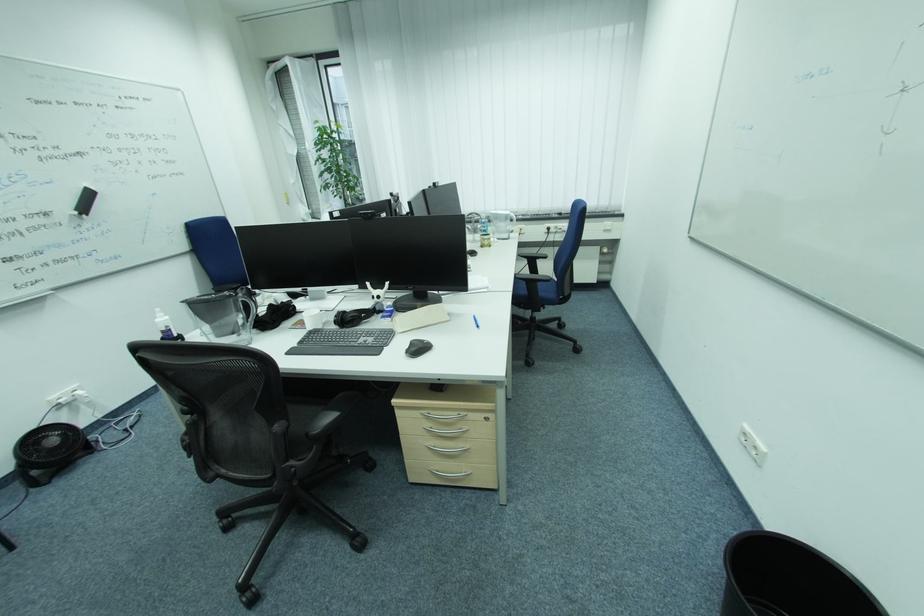
Which object does [787,580] point to?

It corresponds to the black trash can in the image.